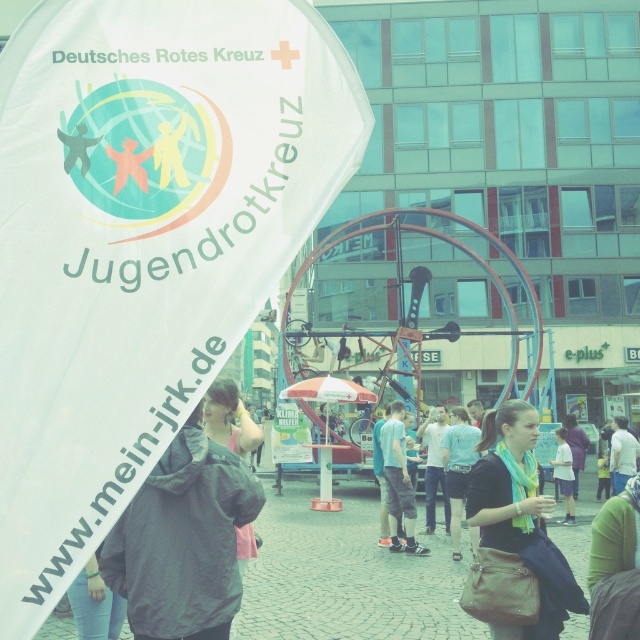
Question: Does teal scarf at center have a smaller size compared to light blue scarf at center?

Choices:
 (A) no
 (B) yes

Answer: (A)

Question: Which point is closer to the camera?

Choices:
 (A) white fabric banner at upper left
 (B) teal scarf at center

Answer: (A)

Question: Which object is the farthest from the light blue scarf at center?

Choices:
 (A) white fabric banner at upper left
 (B) teal scarf at center

Answer: (A)

Question: Is white fabric banner at upper left bigger than light blue scarf at center?

Choices:
 (A) yes
 (B) no

Answer: (A)

Question: Does white fabric banner at upper left appear under teal scarf at center?

Choices:
 (A) no
 (B) yes

Answer: (A)

Question: Which of the following is the farthest from the observer?

Choices:
 (A) teal scarf at center
 (B) white fabric banner at upper left
 (C) light blue scarf at center

Answer: (C)